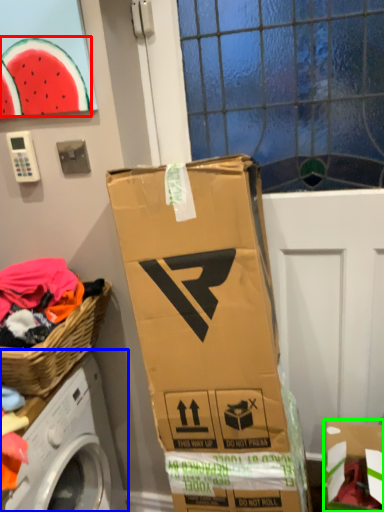
Question: Considering the real-world distances, which object is farthest from watermelon (highlighted by a red box)? washing machine (highlighted by a blue box) or cardboard box (highlighted by a green box)?

Choices:
 (A) washing machine
 (B) cardboard box

Answer: (B)